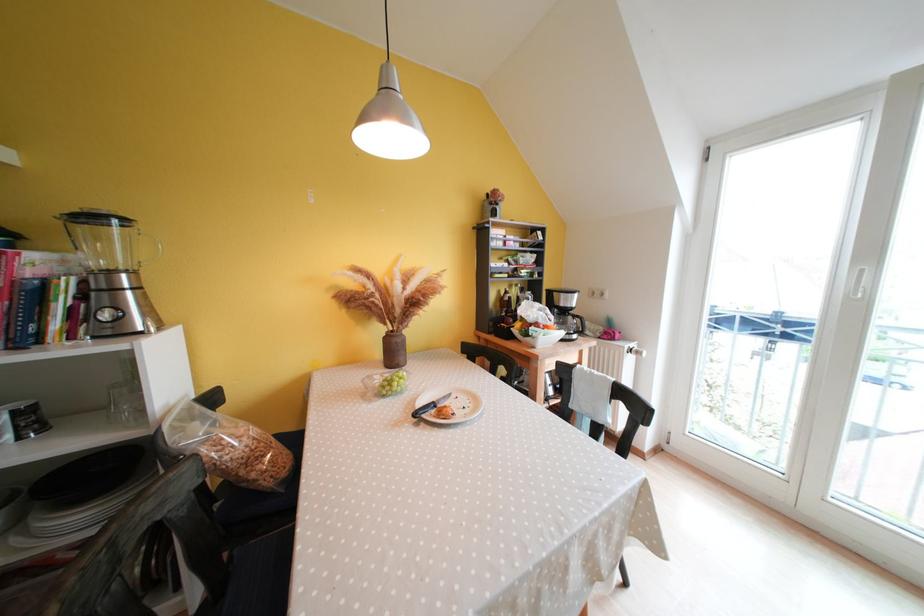
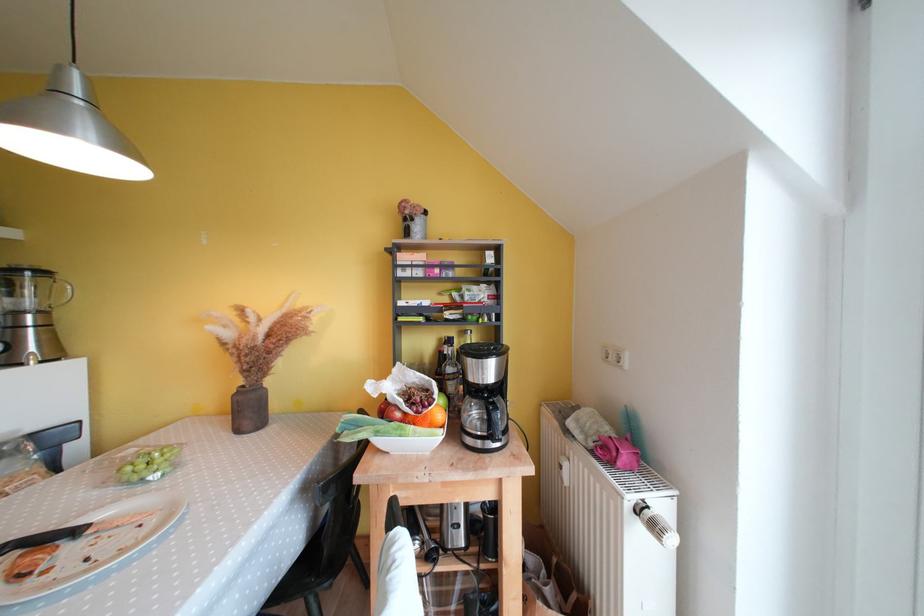
Where in the second image is the point corresponding to (x=579, y=305) from the first image?

(494, 376)